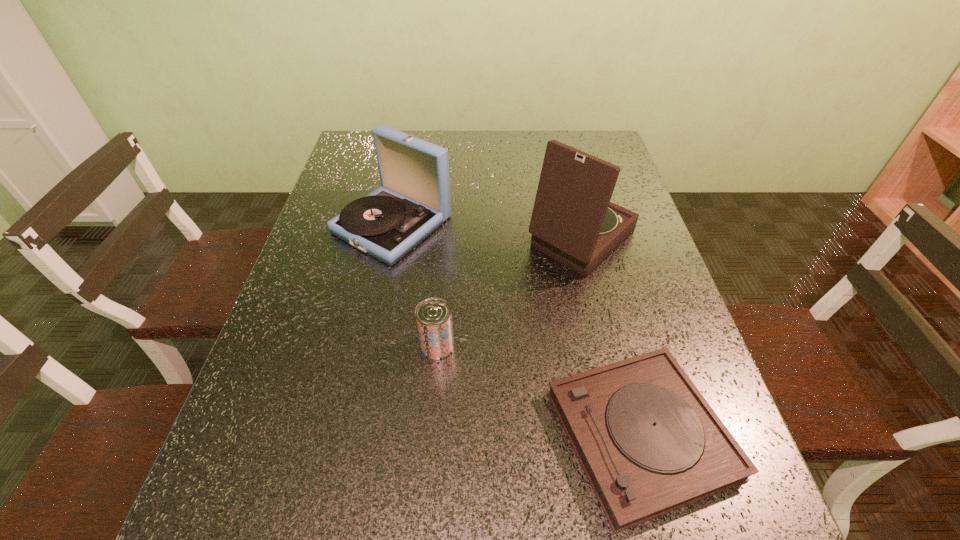
Locate an element on the screen. This screenshot has width=960, height=540. free space between the shortest phonograph record and the second shortest object is located at coordinates (539, 390).

This screenshot has width=960, height=540. In order to click on free space between the second tallest object and the shortest phonograph record in this screenshot , I will do `click(516, 329)`.

The height and width of the screenshot is (540, 960). In order to click on free point between the tallest phonograph record and the nearest phonograph record in this screenshot , I will do `click(611, 336)`.

In order to click on free space between the tallest object and the shortest object in this screenshot , I will do (x=611, y=336).

Find the location of a particular element. free spot between the third shortest object and the second shortest object is located at coordinates (415, 285).

This screenshot has height=540, width=960. Find the location of `vacant point located between the shortest object and the third tallest object`. vacant point located between the shortest object and the third tallest object is located at coordinates (539, 390).

Locate an element on the screen. vacant point located between the tallest object and the nearest phonograph record is located at coordinates point(611,336).

The width and height of the screenshot is (960, 540). I want to click on vacant point located between the second tallest object and the shortest object, so click(516, 329).

Where is `the closest object to the beer can`? This screenshot has height=540, width=960. the closest object to the beer can is located at coordinates (649, 443).

Point out which object is positioned as the second nearest to the second tallest phonograph record. Please provide its 2D coordinates. Your answer should be formatted as a tuple, i.e. [(x, y)], where the tuple contains the x and y coordinates of a point satisfying the conditions above.

[(433, 316)]